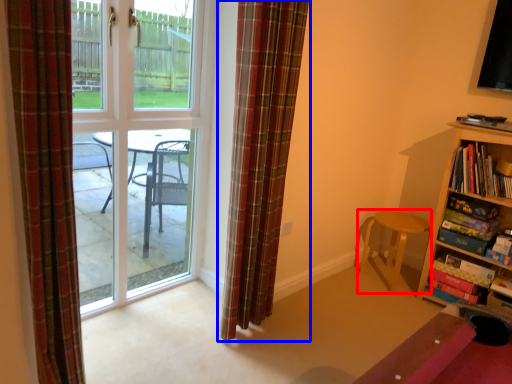
Question: Which object appears closest to the camera in this image, chair (highlighted by a red box) or curtain (highlighted by a blue box)?

Choices:
 (A) chair
 (B) curtain

Answer: (B)